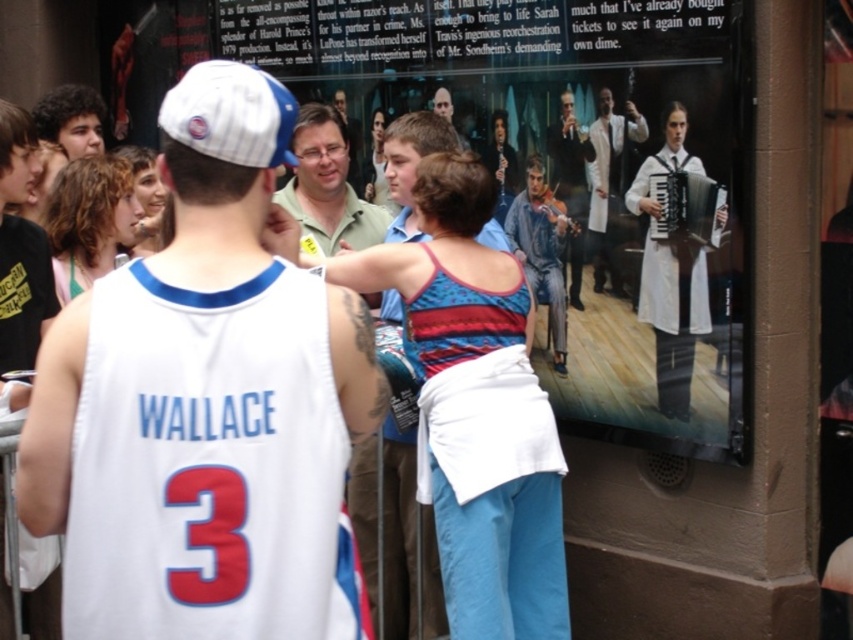
Measure the distance between point (569, 195) and camera.

They are 17.33 feet apart.

Which is more to the right, light brown wood violin at center or smooth brown hair at center?

light brown wood violin at center

What do you see at coordinates (570, 186) in the screenshot? The height and width of the screenshot is (640, 853). I see `light brown wood violin at center` at bounding box center [570, 186].

Where is `light brown wood violin at center`? This screenshot has height=640, width=853. light brown wood violin at center is located at coordinates [570, 186].

How much distance is there between white fabric baseball cap at upper center and smooth brown hair at center?

white fabric baseball cap at upper center is 9.48 feet away from smooth brown hair at center.

Between white fabric baseball cap at upper center and smooth brown hair at center, which one has more height?

smooth brown hair at center

Is point (241, 144) positioned behind point (431, 106)?

No.

The width and height of the screenshot is (853, 640). I want to click on white fabric baseball cap at upper center, so click(x=231, y=115).

Between white cloth accordion at right and light brown wood violin at center, which one appears on the left side from the viewer's perspective?

From the viewer's perspective, light brown wood violin at center appears more on the left side.

Is white cloth accordion at right shorter than light brown wood violin at center?

No.

Consider the image. Who is more forward, [693,292] or [567,141]?

Point [693,292] is in front.

Identify the location of white cloth accordion at right. (671, 273).